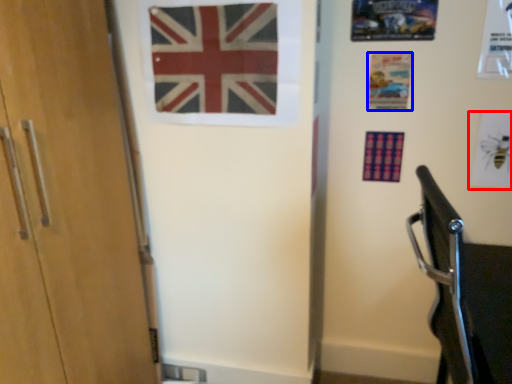
Question: Which point is closer to the camera, postcard (highlighted by a red box) or postcard (highlighted by a blue box)?

Choices:
 (A) postcard
 (B) postcard

Answer: (A)